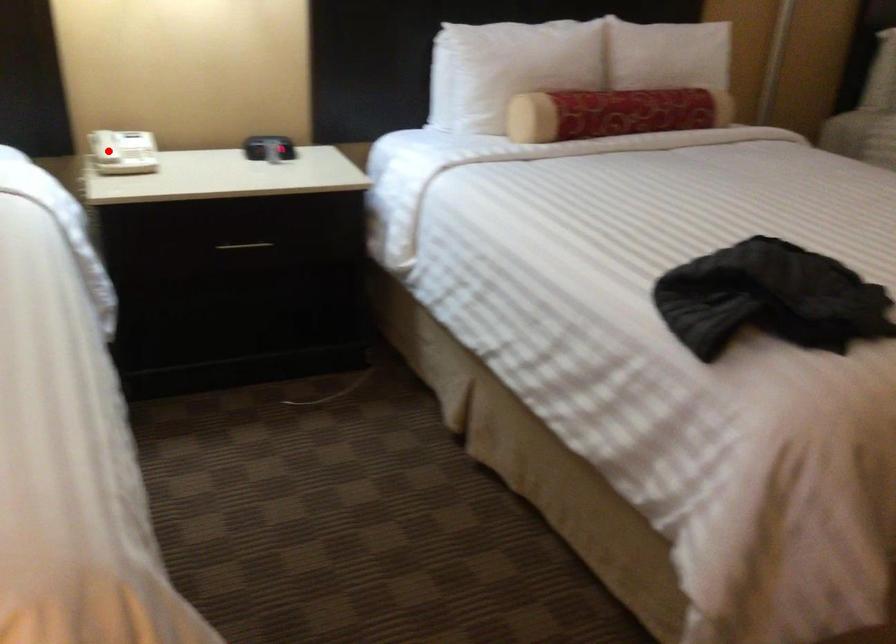
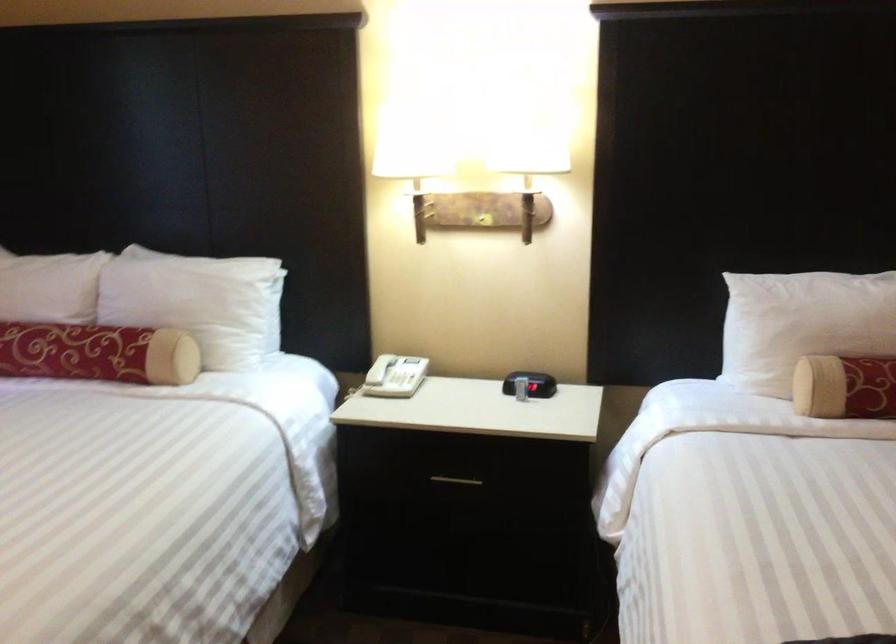
Locate, in the second image, the point that corresponds to the highlighted location in the first image.

(380, 368)